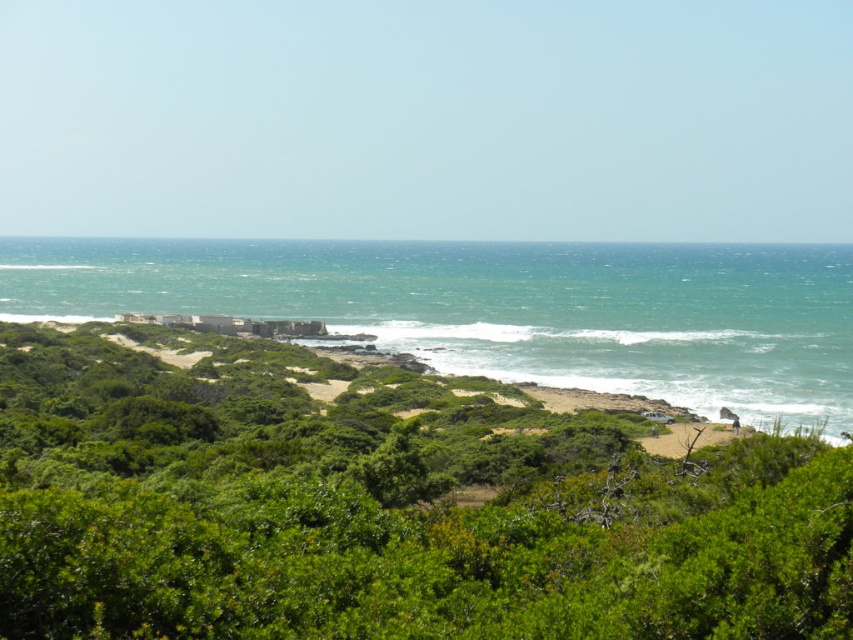
You are standing at the origin point of the coastal landscape. The green leafy shrubs at center are at coordinates point 0.791, 0.450. If you want to walk directly towards the shrubs, which direction should you head?

The green leafy shrubs at center are located at coordinates point (383, 506), so you should head towards the direction of increasing x and y coordinates to reach them.

You are standing at the coastal landscape and want to walk from point A to point B. Point A is at coordinate point (389,442) and point B is at coordinate point (322,301). According to the image, which point is closer to you, point A or point B?

Point A is closer to you because it is in front of point B according to the image description.

You are a hiker who wants to cross from the rocky coastline to the sandy area. You see the green leafy shrubs at center and the green water at center. Which one is closer to you?

The green leafy shrubs at center is smaller than the green water at center, so the green leafy shrubs at center is closer to you.